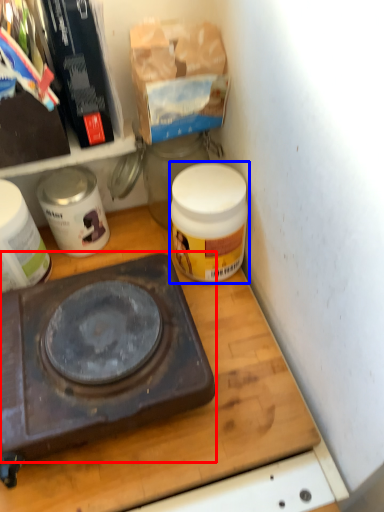
Question: Which object is closer to the camera taking this photo, gas stove (highlighted by a red box) or product (highlighted by a blue box)?

Choices:
 (A) gas stove
 (B) product

Answer: (A)